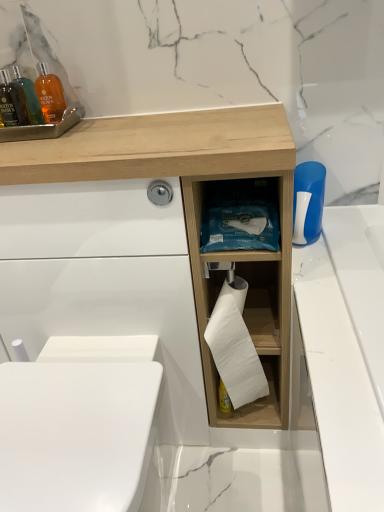
This screenshot has width=384, height=512. I want to click on free space to the right of translucent orange bottle at upper left, positioned as the 2th mouthwash in front-to-back order, so point(107,123).